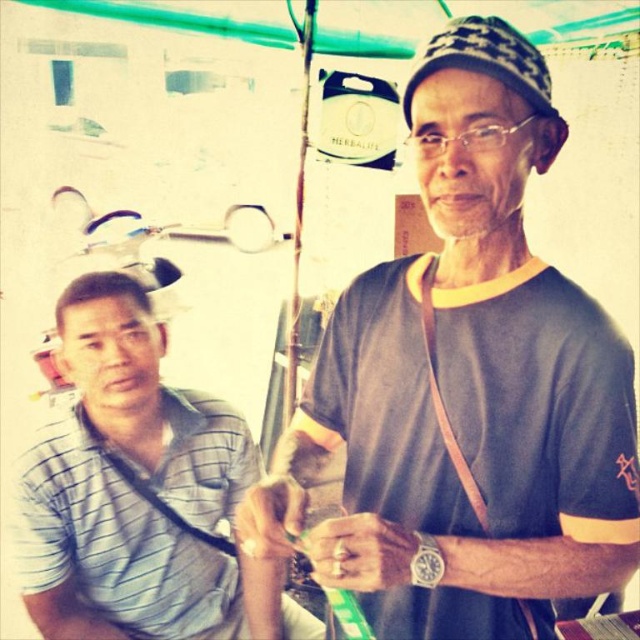
Is dark gray/yellow t-shirt at upper right positioned in front of gray striped shirt at left?

Yes, it is in front of gray striped shirt at left.

Is point (516, 484) positioned after point (147, 355)?

No, it is in front of (147, 355).

Is point (611, 419) farther from camera compared to point (67, 301)?

No, it is not.

Find the location of `dark gray/yellow t-shirt at upper right`. dark gray/yellow t-shirt at upper right is located at coordinates (468, 385).